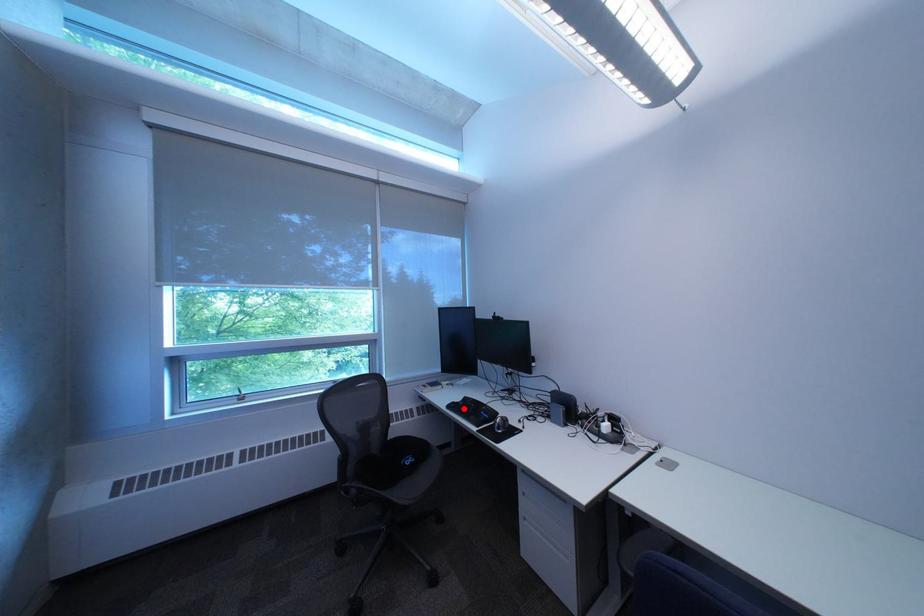
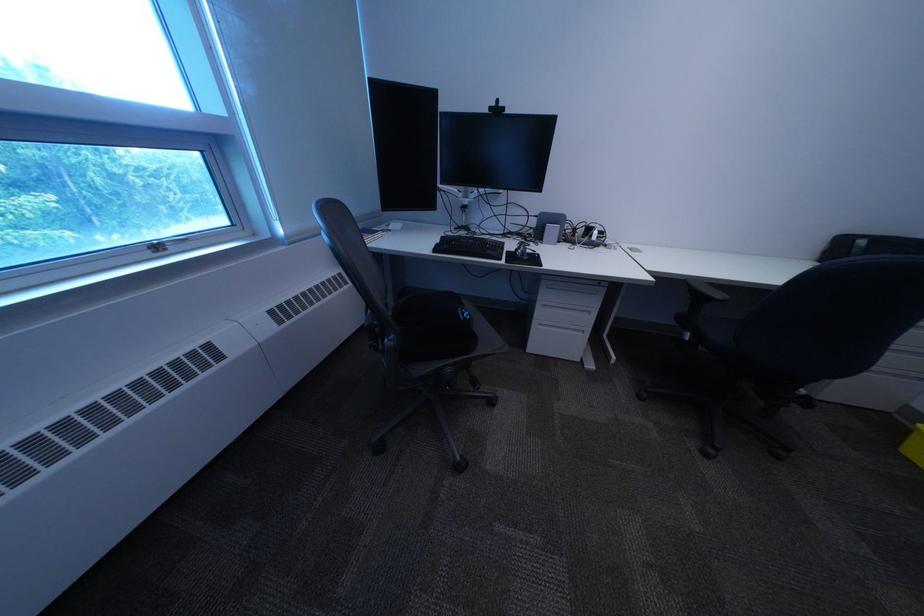
Question: I am providing you with two images of the same scene from different viewpoints. A red point is marked on the first image. Can you still see the location of the red point in image 2?

Choices:
 (A) Yes
 (B) No

Answer: (A)